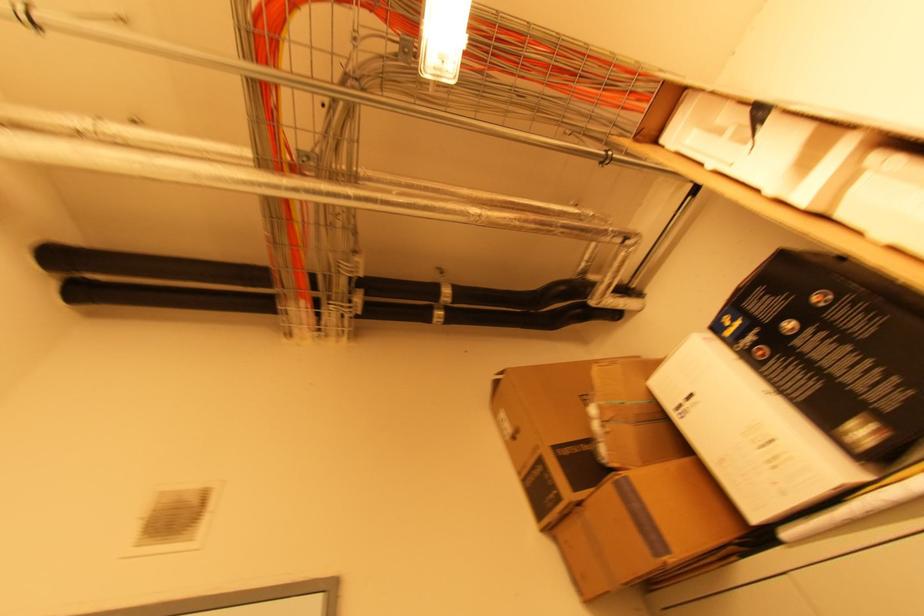
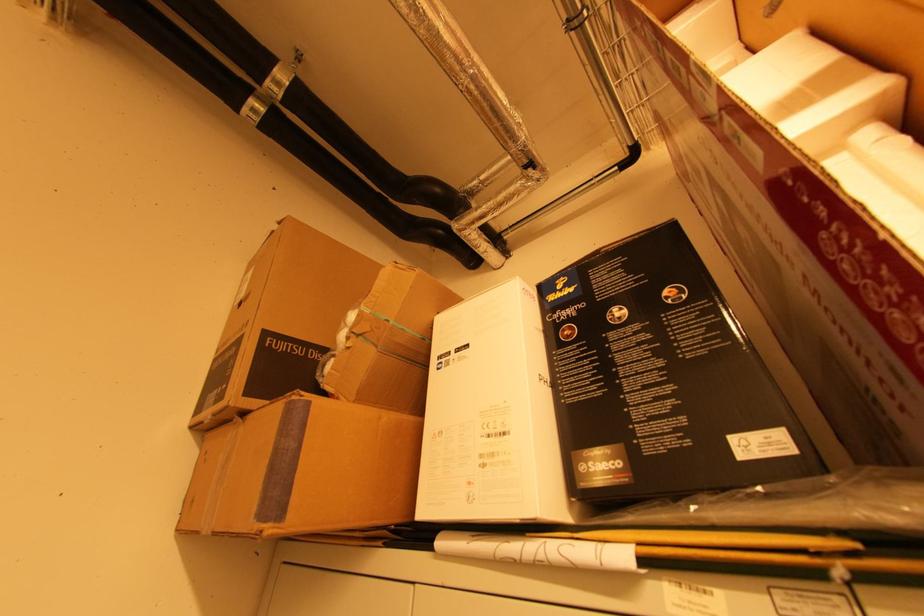
Question: The images are taken continuously from a first-person perspective. In which direction is your viewpoint rotating?

Choices:
 (A) Left
 (B) Right
 (C) Up
 (D) Down

Answer: (B)